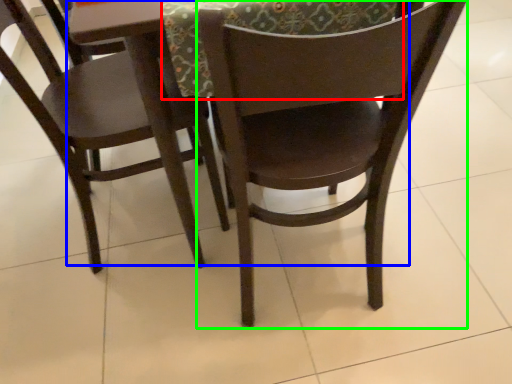
Question: Which object is positioned closest to tablecloth (highlighted by a red box)? Select from round table (highlighted by a blue box) and chair (highlighted by a green box).

Choices:
 (A) round table
 (B) chair

Answer: (A)